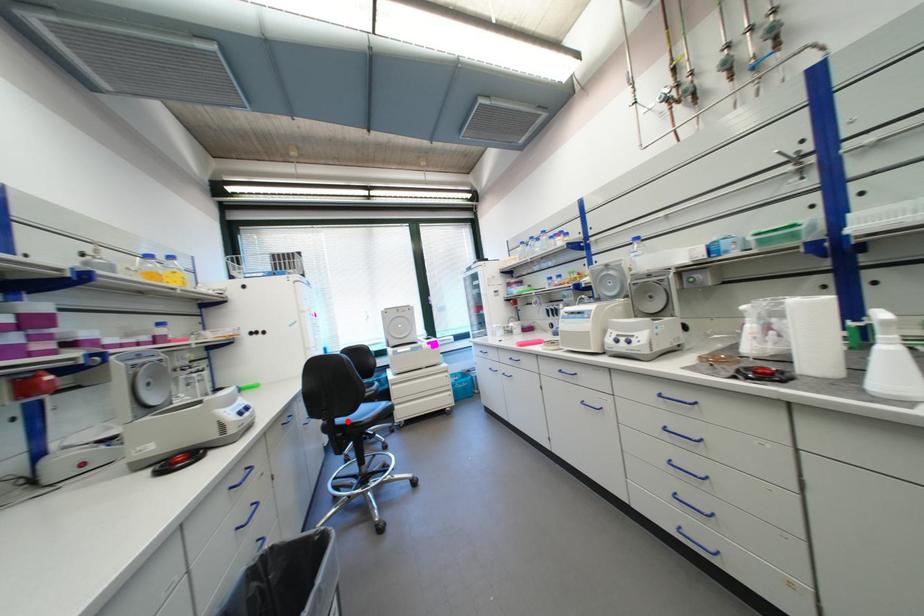
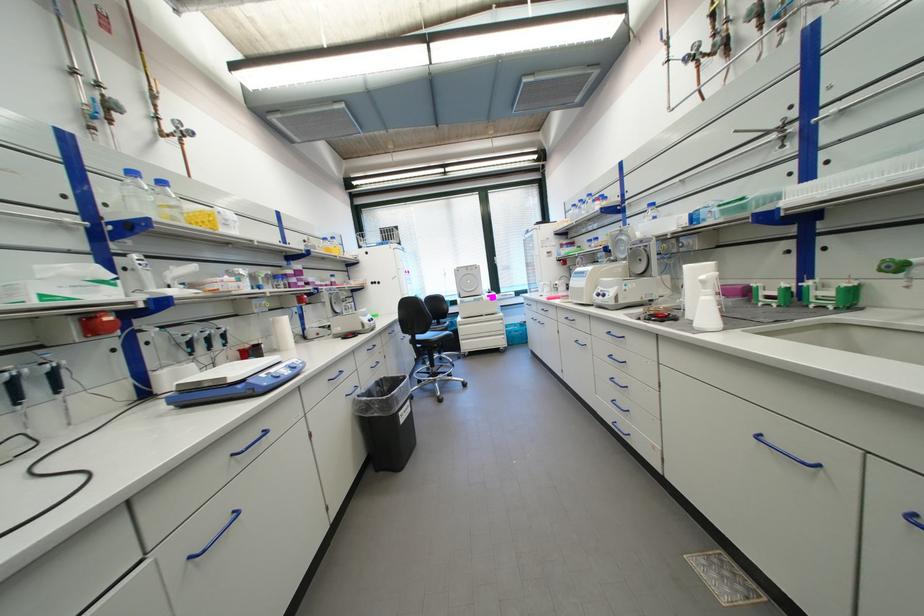
In the second image, find the point that corresponds to the highlighted location in the first image.

(427, 338)